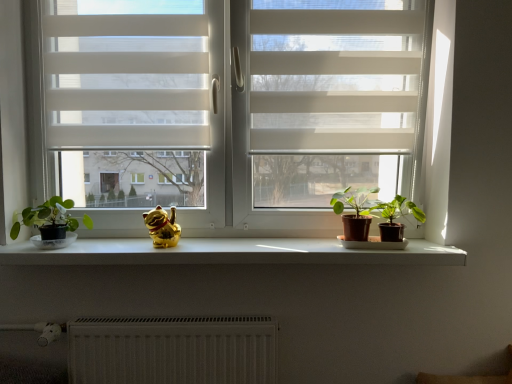
You are a GUI agent. You are given a task and a screenshot of the screen. Output one action in this format:
    pyautogui.click(x=<x>, y=<y>)
    Task: Click on the empty space that is in between green matte plant at left, the 3th houseplant when ordered from right to left, and green matte plant at center, placed as the 2th houseplant when sorted from right to left
    
    Given the screenshot: What is the action you would take?
    pyautogui.click(x=208, y=246)